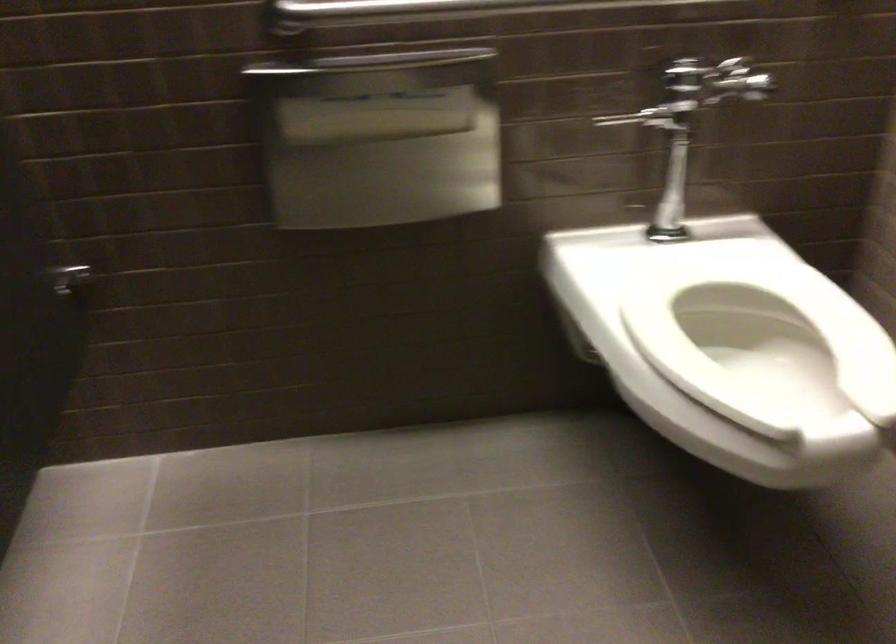
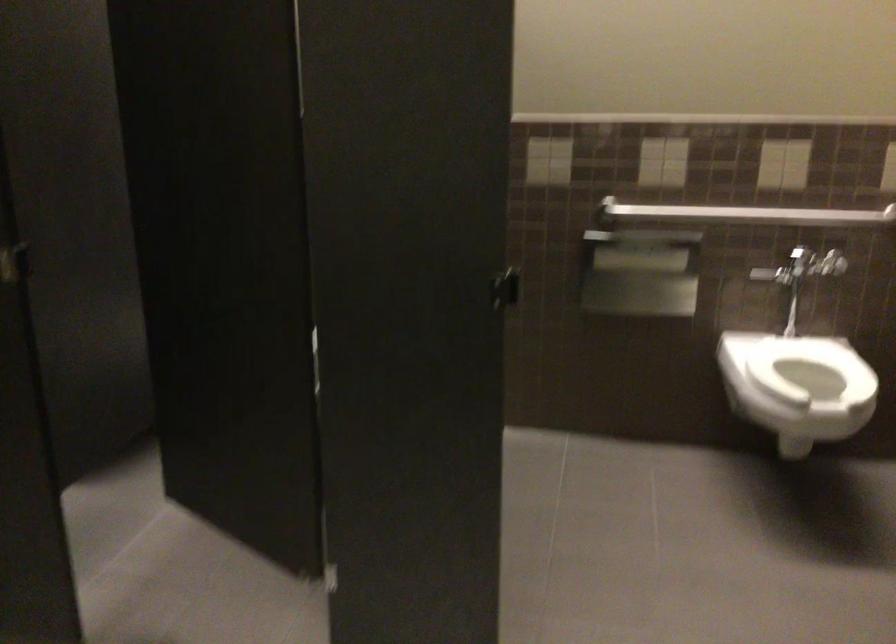
Question: What movement of the cameraman would produce the second image?

Choices:
 (A) Left
 (B) Right
 (C) Forward
 (D) Backward

Answer: (D)